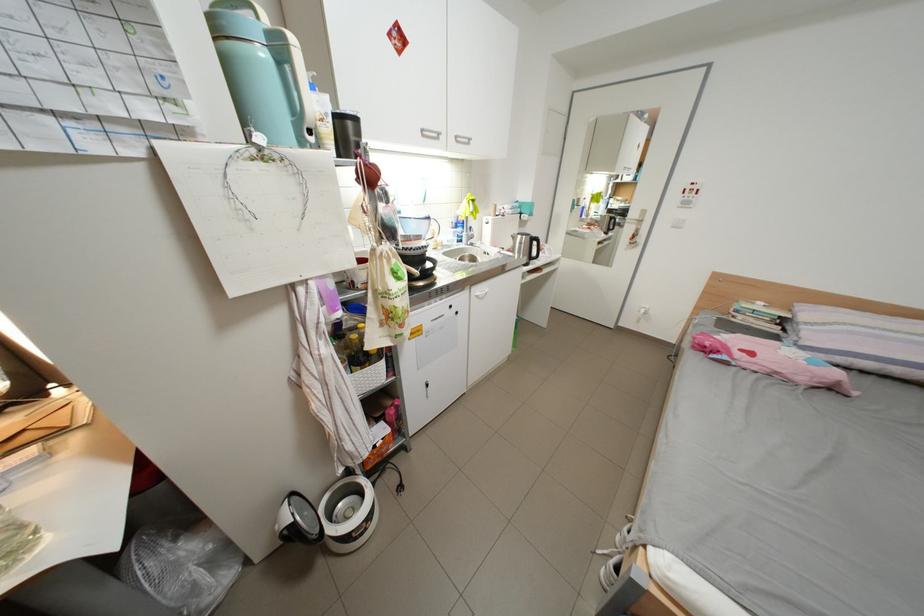
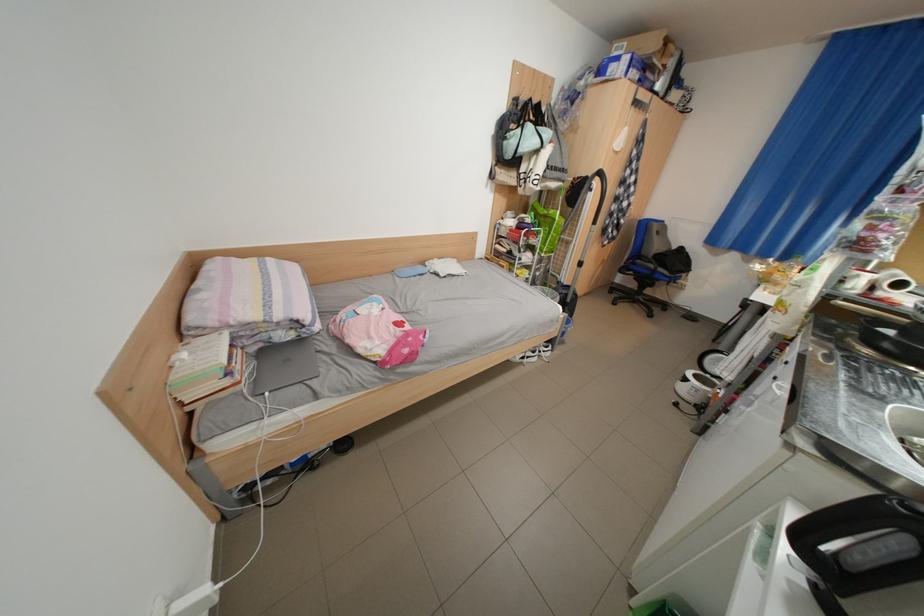
Find the pixel in the second image that matches [468,314] in the first image.

(786, 379)